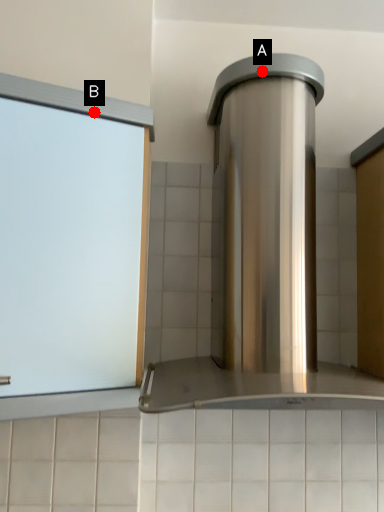
Question: Two points are circled on the image, labeled by A and B beside each circle. Which point appears closest to the camera in this image?

Choices:
 (A) A is closer
 (B) B is closer

Answer: (B)